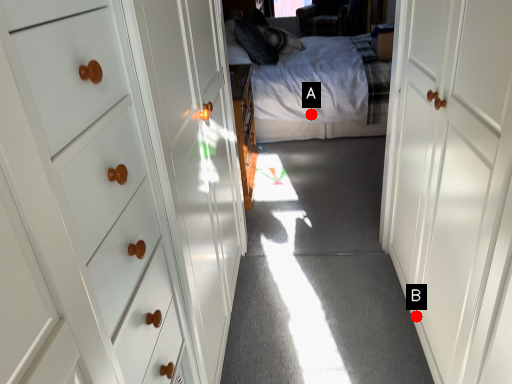
Question: Two points are circled on the image, labeled by A and B beside each circle. Which of the following is the farthest from the observer?

Choices:
 (A) A is further
 (B) B is further

Answer: (A)